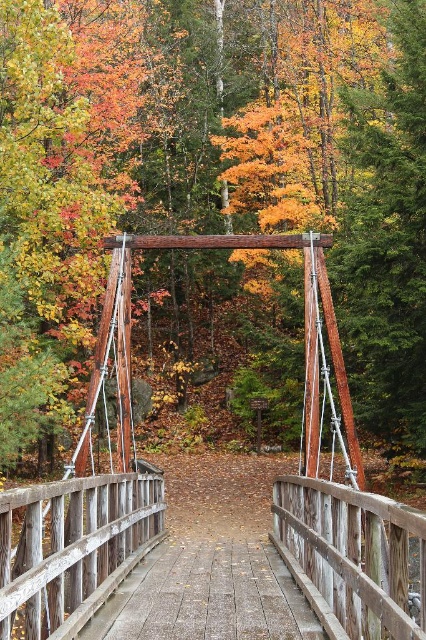
Question: Based on their relative distances, which object is nearer to the wooden planks at center?

Choices:
 (A) wooden swing at center
 (B) wooden bridge at center

Answer: (B)

Question: Among these objects, which one is farthest from the camera?

Choices:
 (A) wooden swing at center
 (B) wooden planks at center

Answer: (A)

Question: Which is farther from the wooden swing at center?

Choices:
 (A) wooden bridge at center
 (B) wooden planks at center

Answer: (B)

Question: From the image, what is the correct spatial relationship of wooden swing at center in relation to wooden bridge at center?

Choices:
 (A) above
 (B) below

Answer: (A)

Question: Does wooden swing at center appear under wooden bridge at center?

Choices:
 (A) no
 (B) yes

Answer: (A)

Question: Is wooden bridge at center closer to the viewer compared to wooden planks at center?

Choices:
 (A) no
 (B) yes

Answer: (B)